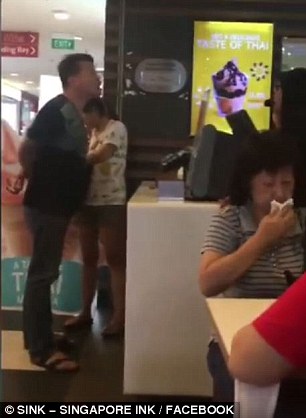
At what (x,y) coordinates should I click in order to perform the action: click on floor. Please return your answer as a coordinate pair (x, y). Looking at the image, I should click on (102, 371).